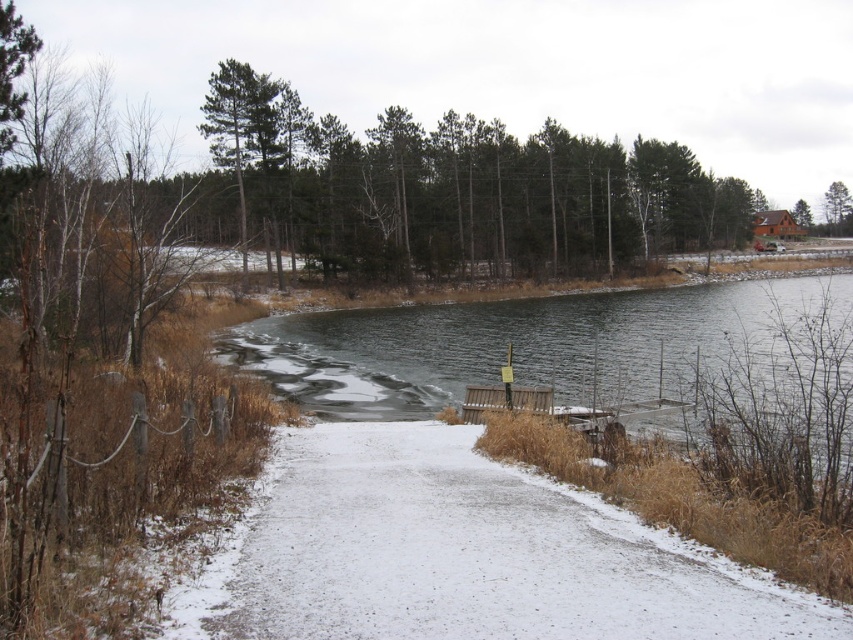
Can you confirm if white snow-covered path at center is positioned below green matte tree at upper right?

Yes, white snow-covered path at center is below green matte tree at upper right.

Can you confirm if white snow-covered path at center is thinner than green matte tree at upper right?

Indeed, white snow-covered path at center has a lesser width compared to green matte tree at upper right.

Which is behind, point (300, 540) or point (834, 209)?

The point (834, 209) is behind.

Image resolution: width=853 pixels, height=640 pixels. What are the coordinates of `white snow-covered path at center` in the screenshot? It's located at point(474,554).

Is white snow-covered path at center taller than brown wood tree at upper right?

No, white snow-covered path at center is not taller than brown wood tree at upper right.

Measure the distance from white snow-covered path at center to brown wood tree at upper right.

169.22 meters

Does point (283, 611) lie in front of point (792, 212)?

Yes, it is in front of point (792, 212).

Identify the location of white snow-covered path at center. (474, 554).

Which is in front, point (833, 221) or point (793, 212)?

Point (793, 212) is in front.

Where is `green matte tree at upper right`? This screenshot has width=853, height=640. green matte tree at upper right is located at coordinates (836, 204).

Where is `green matte tree at upper right`? green matte tree at upper right is located at coordinates (836, 204).